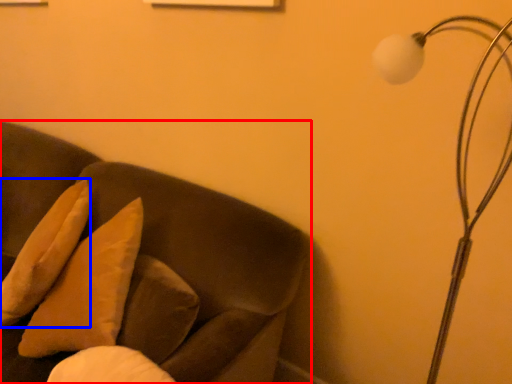
Question: Which object appears closest to the camera in this image, furniture (highlighted by a red box) or pillow (highlighted by a blue box)?

Choices:
 (A) furniture
 (B) pillow

Answer: (A)